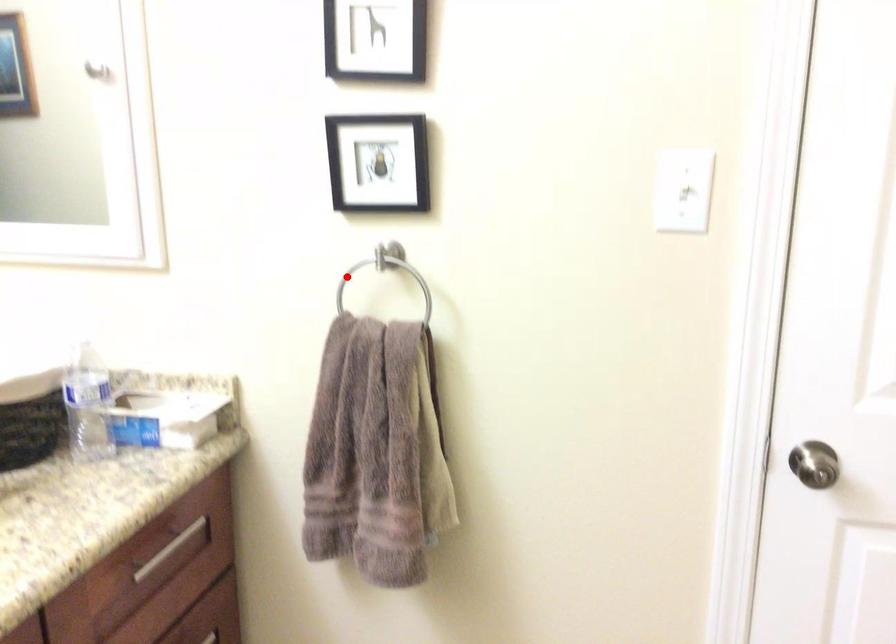
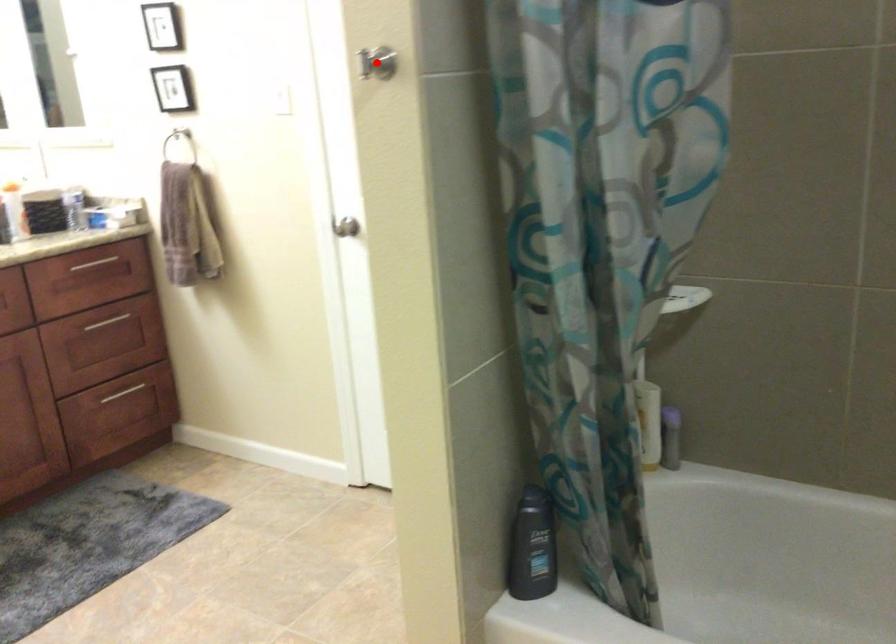
I am providing you with two images of the same scene from different viewpoints. A red point is marked on the first image and another point is marked on the second image. Do the highlighted points in image1 and image2 indicate the same real-world spot?

No